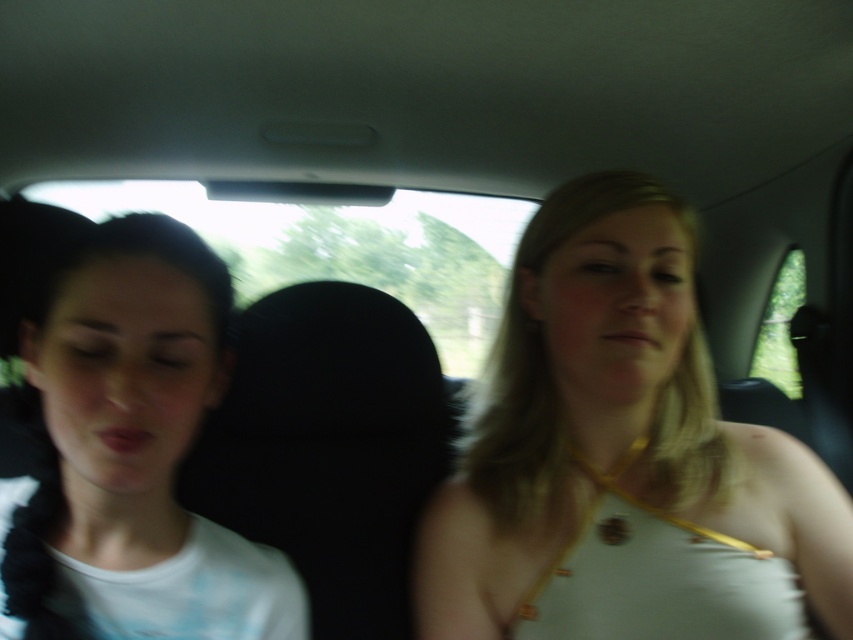
You are a tailor trying to determine if the white matte shirt at left can be folded and placed inside the black fabric headrest at center. Based on the provided information, can the shirt fit inside the headrest?

The white matte shirt at left is thinner than the black fabric headrest at center, so it can be folded and placed inside the headrest.

Looking at this image, you are a fashion designer observing a car interior scene. You notice the white fabric top at center and the white matte shirt at left. Which clothing item has a bigger size?

The white fabric top at center is larger in size than the white matte shirt at left according to the description.